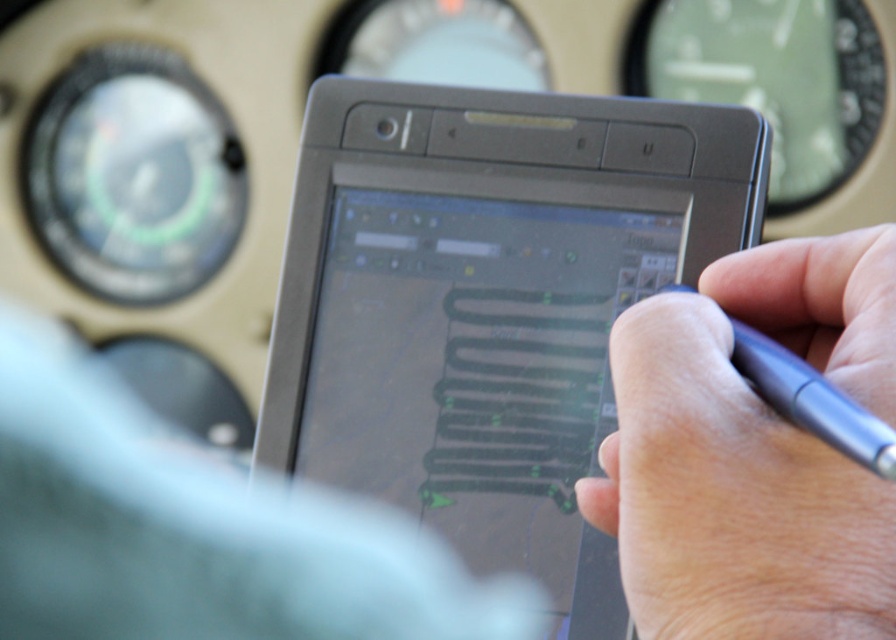
Question: Which point is farther from the camera taking this photo?

Choices:
 (A) (618, 172)
 (B) (886, 556)

Answer: (A)

Question: Is the position of white matte pen at center more distant than that of metallic blue pen at right?

Choices:
 (A) yes
 (B) no

Answer: (A)

Question: Does white matte pen at center appear on the right side of metallic blue pen at right?

Choices:
 (A) yes
 (B) no

Answer: (B)

Question: Considering the real-world distances, which object is closest to the black matte tablet at center?

Choices:
 (A) metallic blue pen at right
 (B) white matte pen at center

Answer: (A)

Question: Observing the image, what is the correct spatial positioning of black matte tablet at center in reference to metallic blue pen at right?

Choices:
 (A) right
 (B) left

Answer: (B)

Question: Estimate the real-world distances between objects in this image. Which object is farther from the metallic blue pen at right?

Choices:
 (A) white matte pen at center
 (B) black matte tablet at center

Answer: (B)